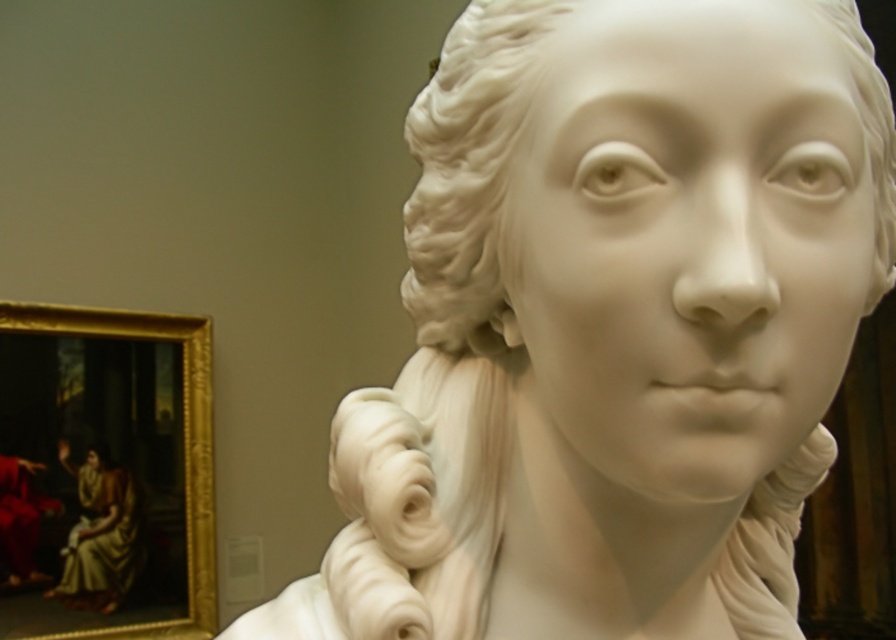
You are an art conservator holding a 30 cm wide cleaning tool. You need to clean the white marble bust at center. Can you fit your tool between yourself and the bust without moving your position?

The distance of white marble bust at center from viewer is 35.27 centimeters, so yes, the 30 cm wide tool can fit as it is shorter than the 35.27 cm distance available.

You are an art conservator examining the image. You need to determine the spatial relationship between the white marble bust at center and the matte gold fabric at left. Based on the scene, which object is closer to the viewer?

The white marble bust at center is closer to the viewer than the matte gold fabric at left because it is positioned in front of it.